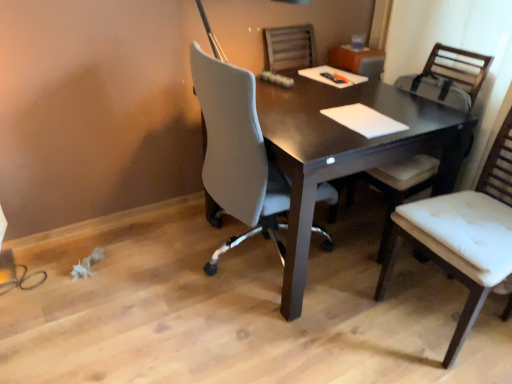
Question: From a real-world perspective, is dark wood desk at center physically below white fabric chair at right, which is the 1th chair from back to front?

Choices:
 (A) no
 (B) yes

Answer: (B)

Question: From the image's perspective, is dark wood desk at center on top of white fabric chair at right, which is the 1th chair from back to front?

Choices:
 (A) yes
 (B) no

Answer: (B)

Question: Is dark wood desk at center at the left side of white fabric chair at right, which is the 1th chair from back to front?

Choices:
 (A) yes
 (B) no

Answer: (A)

Question: Is dark wood desk at center not near white fabric chair at right, which is the 1th chair from back to front?

Choices:
 (A) no
 (B) yes

Answer: (A)

Question: Does dark wood desk at center have a greater width compared to white fabric chair at right, positioned as the 2th chair in front-to-back order?

Choices:
 (A) no
 (B) yes

Answer: (B)

Question: From a real-world perspective, is dark wood desk at center physically located above or below white fabric chair at right, which is the 1th chair from back to front?

Choices:
 (A) above
 (B) below

Answer: (B)

Question: Is dark wood desk at center wider or thinner than white fabric chair at right, positioned as the 2th chair in front-to-back order?

Choices:
 (A) wide
 (B) thin

Answer: (A)

Question: Is point [381, 112] closer or farther from the camera than point [420, 188]?

Choices:
 (A) closer
 (B) farther

Answer: (A)

Question: Choose the correct answer: Is dark wood desk at center inside white fabric chair at right, which is the 1th chair from back to front, or outside it?

Choices:
 (A) outside
 (B) inside

Answer: (A)

Question: Does point (429, 62) appear closer or farther from the camera than point (326, 124)?

Choices:
 (A) farther
 (B) closer

Answer: (A)

Question: Looking at their shapes, would you say white fabric chair at right, positioned as the 2th chair in front-to-back order, is wider or thinner than dark wood desk at center?

Choices:
 (A) wide
 (B) thin

Answer: (B)

Question: From a real-world perspective, is white fabric chair at right, which is the 1th chair from back to front, positioned above or below dark wood desk at center?

Choices:
 (A) above
 (B) below

Answer: (A)

Question: From the image's perspective, is white fabric chair at right, positioned as the 2th chair in front-to-back order, positioned above or below dark wood desk at center?

Choices:
 (A) below
 (B) above

Answer: (B)

Question: Is white leather chair at right, which is the 1th chair in front-to-back order, bigger or smaller than white fabric chair at right, which is the 1th chair from back to front?

Choices:
 (A) small
 (B) big

Answer: (A)

Question: Is white leather chair at right, which is the 1th chair in front-to-back order, spatially inside white fabric chair at right, positioned as the 2th chair in front-to-back order, or outside of it?

Choices:
 (A) inside
 (B) outside

Answer: (B)